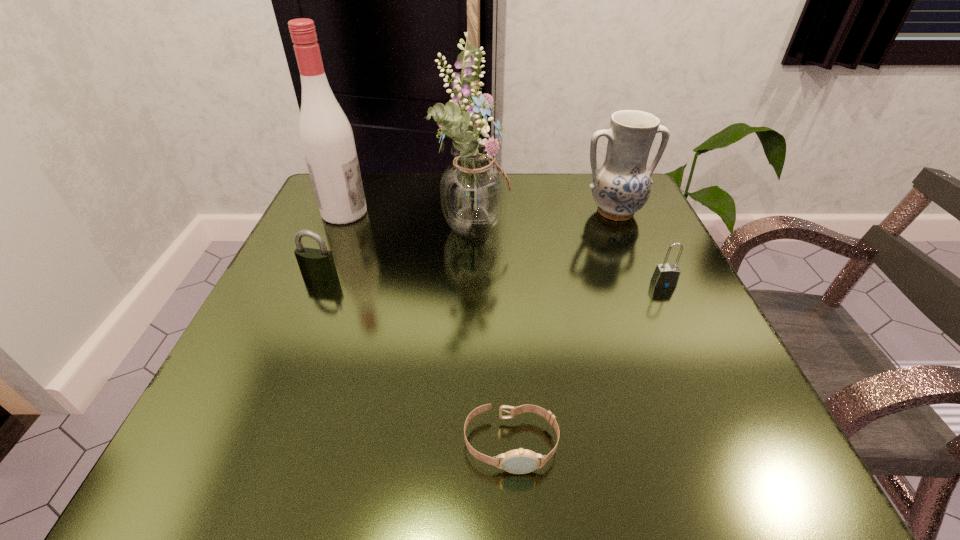
You are a GUI agent. You are given a task and a screenshot of the screen. Output one action in this format:
    pyautogui.click(x=<x>, y=<y>)
    Task: Click on the alcohol
    Image resolution: width=960 pixels, height=540 pixels.
    Given the screenshot: What is the action you would take?
    pyautogui.click(x=326, y=136)

At what (x,y) coordinates should I click in order to perform the action: click on bouquet. Please return your answer as a coordinate pair (x, y). Looking at the image, I should click on (473, 189).

Find the location of `the fourth shortest object`. the fourth shortest object is located at coordinates (621, 186).

What are the coordinates of `the left padlock` in the screenshot? It's located at (318, 264).

Find the location of `the right padlock`. the right padlock is located at coordinates (666, 275).

Identify the location of the shortest object. (518, 461).

The height and width of the screenshot is (540, 960). I want to click on the nearest object, so click(518, 461).

You are a GUI agent. You are given a task and a screenshot of the screen. Output one action in this format:
    pyautogui.click(x=<x>, y=<y>)
    Task: Click on the free space located 0.170m on the label of the alcohol
    
    Given the screenshot: What is the action you would take?
    pyautogui.click(x=443, y=213)

Where is `free point located on the front-facing side of the bouquet`? This screenshot has width=960, height=540. free point located on the front-facing side of the bouquet is located at coordinates click(642, 223).

Identify the location of free space located 0.330m on the front of the pottery. The height and width of the screenshot is (540, 960). (671, 345).